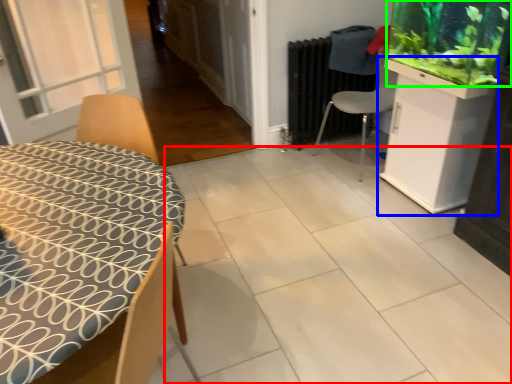
Question: Considering the real-world distances, which object is farthest from tile (highlighted by a red box)? cabinetry (highlighted by a blue box) or plant (highlighted by a green box)?

Choices:
 (A) cabinetry
 (B) plant

Answer: (B)